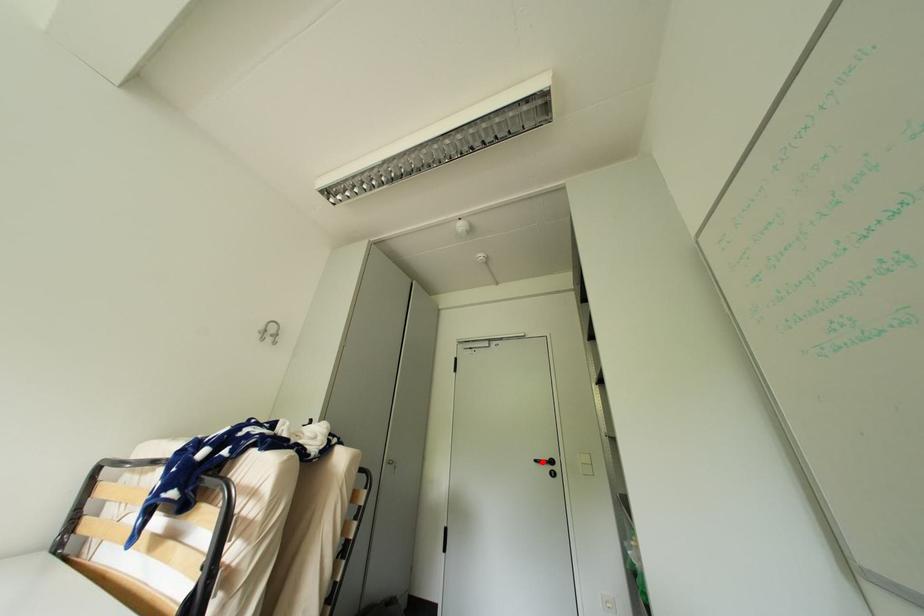
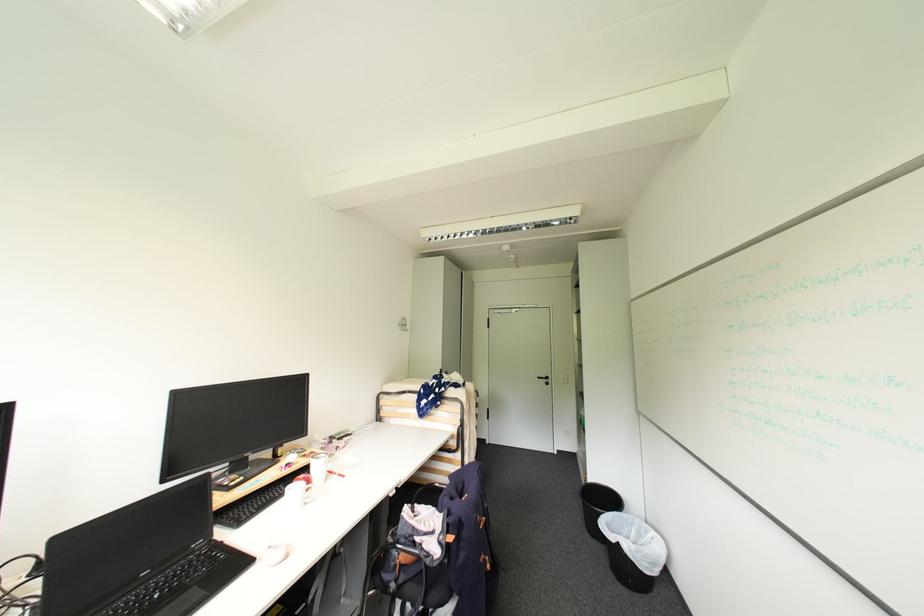
Question: I am providing you with two images of the same scene from different viewpoints. A red point is marked on the first image. At the location where the point appears in image 1, is it still visible in image 2?

Choices:
 (A) Yes
 (B) No

Answer: (A)